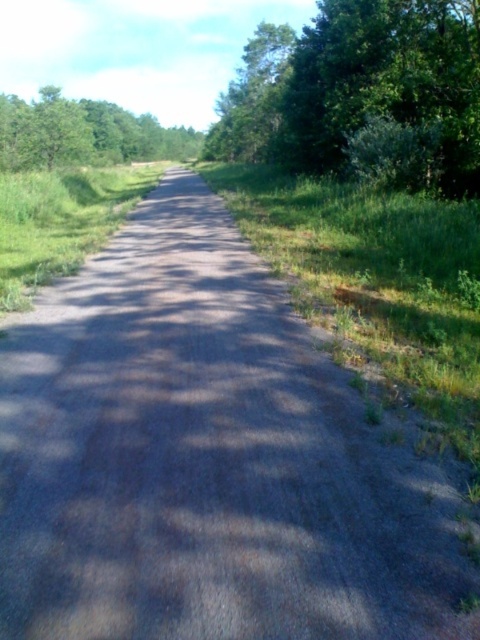
Question: Can you confirm if green leafy tree at upper right is smaller than green leafy tree at upper left?

Choices:
 (A) no
 (B) yes

Answer: (A)

Question: Which object appears farthest from the camera in this image?

Choices:
 (A) green leafy tree at upper right
 (B) green leafy tree at upper left

Answer: (B)

Question: Is the position of green leafy tree at upper right more distant than that of green leafy tree at upper left?

Choices:
 (A) no
 (B) yes

Answer: (A)

Question: Among these objects, which one is farthest from the camera?

Choices:
 (A) green leafy tree at upper left
 (B) green leafy tree at upper right

Answer: (A)

Question: Is green leafy tree at upper right smaller than green leafy tree at upper left?

Choices:
 (A) yes
 (B) no

Answer: (B)